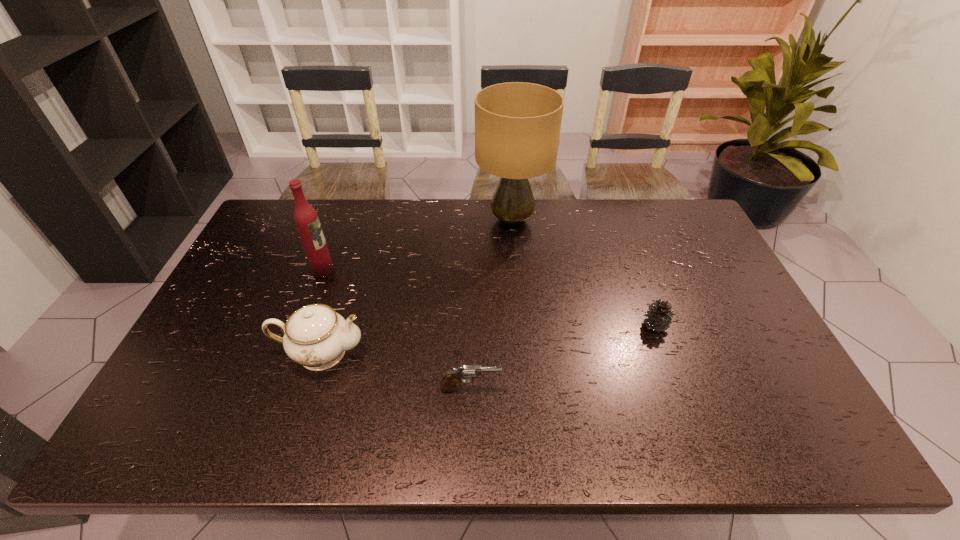
Find the location of a particular element. The image size is (960, 540). free space located at the barrel of the nearest object is located at coordinates (550, 389).

Find the location of `vacant space located 0.070m on the back of the rightmost object`. vacant space located 0.070m on the back of the rightmost object is located at coordinates (645, 297).

Identify the location of object at the far edge. (517, 125).

In the image, there is a desktop. Identify the location of vacant region at the far edge. (504, 231).

Where is `vacant space at the near edge`? Image resolution: width=960 pixels, height=540 pixels. vacant space at the near edge is located at coordinates (291, 421).

The height and width of the screenshot is (540, 960). In order to click on free space at the right edge of the desktop in this screenshot , I will do `click(738, 320)`.

Where is `blank area at the far left corner`? blank area at the far left corner is located at coordinates (266, 230).

The image size is (960, 540). What are the coordinates of `vacant space at the far right corner of the desktop` in the screenshot? It's located at (648, 215).

This screenshot has width=960, height=540. What are the coordinates of `vacant space at the near right corner` in the screenshot? It's located at (785, 425).

At what (x,y) coordinates should I click in order to perform the action: click on unoccupied position between the farthest object and the liquor. Please return your answer as a coordinate pair (x, y). The image size is (960, 540). Looking at the image, I should click on (418, 245).